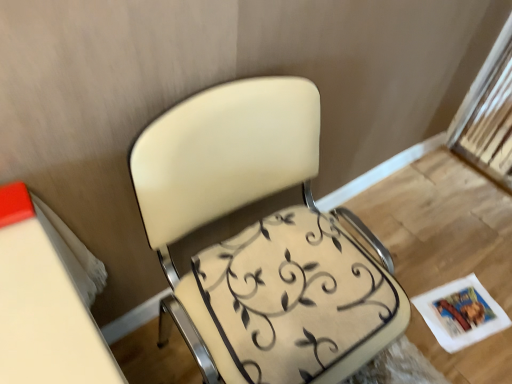
Question: From a real-world perspective, is matte cream chair at center physically below white paper magazine at lower right?

Choices:
 (A) yes
 (B) no

Answer: (B)

Question: Is matte cream chair at center outside white paper magazine at lower right?

Choices:
 (A) no
 (B) yes

Answer: (B)

Question: Is matte cream chair at center at the left side of white paper magazine at lower right?

Choices:
 (A) no
 (B) yes

Answer: (B)

Question: Considering the relative positions of matte cream chair at center and white paper magazine at lower right in the image provided, is matte cream chair at center behind white paper magazine at lower right?

Choices:
 (A) no
 (B) yes

Answer: (A)

Question: Is matte cream chair at center facing away from white paper magazine at lower right?

Choices:
 (A) no
 (B) yes

Answer: (A)

Question: Is matte cream chair at center not near white paper magazine at lower right?

Choices:
 (A) yes
 (B) no

Answer: (B)

Question: From the image's perspective, is matte cream chair at center below beige fabric swivel chair at center?

Choices:
 (A) yes
 (B) no

Answer: (B)

Question: From the image's perspective, is matte cream chair at center above beige fabric swivel chair at center?

Choices:
 (A) yes
 (B) no

Answer: (A)

Question: Can you confirm if matte cream chair at center is positioned to the left of beige fabric swivel chair at center?

Choices:
 (A) yes
 (B) no

Answer: (A)

Question: Is matte cream chair at center surrounding beige fabric swivel chair at center?

Choices:
 (A) yes
 (B) no

Answer: (A)

Question: Is matte cream chair at center further to the viewer compared to beige fabric swivel chair at center?

Choices:
 (A) no
 (B) yes

Answer: (A)

Question: Considering the relative sizes of matte cream chair at center and beige fabric swivel chair at center in the image provided, is matte cream chair at center bigger than beige fabric swivel chair at center?

Choices:
 (A) yes
 (B) no

Answer: (A)

Question: Is white paper magazine at lower right thinner than matte cream chair at center?

Choices:
 (A) yes
 (B) no

Answer: (A)